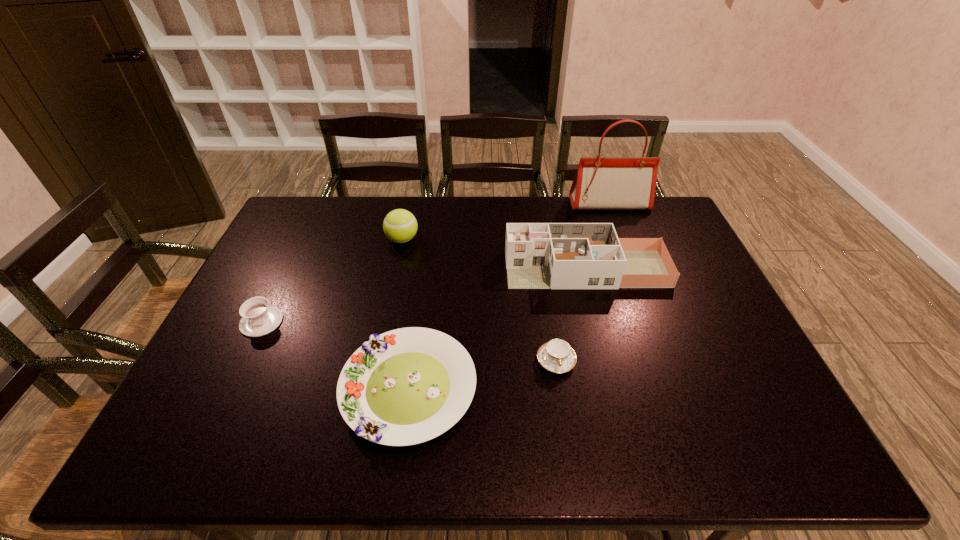
Locate an element on the screen. The height and width of the screenshot is (540, 960). blank area in the image that satisfies the following two spatial constraints: 1. on the handle side of the salad plate; 2. on the right side of the leftmost object is located at coordinates (229, 388).

Locate an element on the screen. Image resolution: width=960 pixels, height=540 pixels. free space that satisfies the following two spatial constraints: 1. on the handle side of the salad plate; 2. on the right side of the farther teacup is located at coordinates (229, 388).